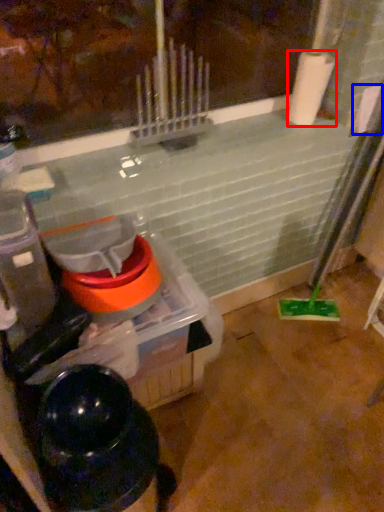
Question: Among these objects, which one is nearest to the camera, paper towel (highlighted by a red box) or toilet paper (highlighted by a blue box)?

Choices:
 (A) paper towel
 (B) toilet paper

Answer: (A)